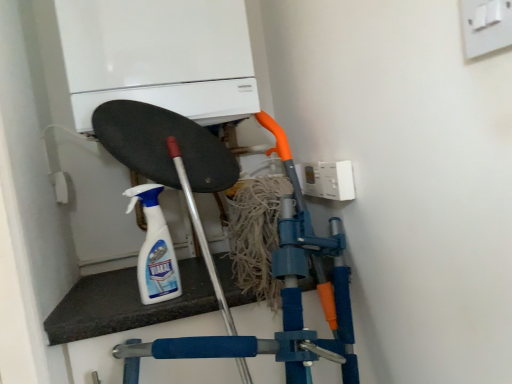
Locate an element on the screen. vacant space that is to the left of white plastic spray bottle at center is located at coordinates (99, 304).